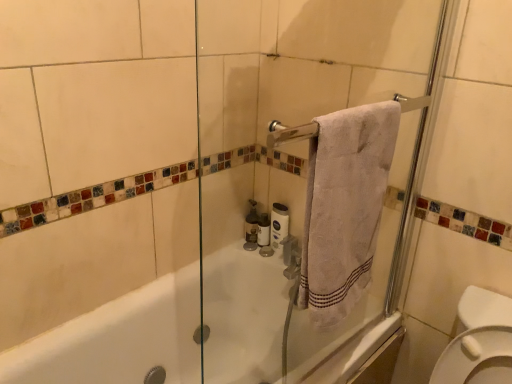
This screenshot has width=512, height=384. Describe the element at coordinates (251, 227) in the screenshot. I see `matte glass soap dispenser at center` at that location.

The width and height of the screenshot is (512, 384). Identify the location of white cotton towel at upper right. (345, 206).

What is the approximate height of white matte toilet paper at center, which is the first toilet paper in right-to-left order?

white matte toilet paper at center, which is the first toilet paper in right-to-left order, is 8.09 inches in height.

Locate an element on the screen. The width and height of the screenshot is (512, 384). transparent glass screen door at center is located at coordinates (303, 180).

Looking at the image, does white matte toilet paper at center, the 2th toilet paper positioned from the left, seem bigger or smaller compared to white matte toilet paper at center, which ranks as the first toilet paper in left-to-right order?

In the image, white matte toilet paper at center, the 2th toilet paper positioned from the left, appears to be larger than white matte toilet paper at center, which ranks as the first toilet paper in left-to-right order.

Is white matte toilet paper at center, which ranks as the first toilet paper in left-to-right order, surrounded by white matte toilet paper at center, the 2th toilet paper positioned from the left?

No.

From their relative heights in the image, would you say white matte toilet paper at center, the 2th toilet paper positioned from the left, is taller or shorter than white matte toilet paper at center, marked as the second toilet paper in a right-to-left arrangement?

white matte toilet paper at center, the 2th toilet paper positioned from the left, is taller than white matte toilet paper at center, marked as the second toilet paper in a right-to-left arrangement.

Looking at this image, is white matte toilet paper at center, the 2th toilet paper positioned from the left, oriented towards white matte toilet paper at center, which ranks as the first toilet paper in left-to-right order?

No, white matte toilet paper at center, the 2th toilet paper positioned from the left, does not turn towards white matte toilet paper at center, which ranks as the first toilet paper in left-to-right order.

Can you confirm if white matte toilet paper at center, marked as the second toilet paper in a right-to-left arrangement, is smaller than white cotton towel at upper right?

Correct, white matte toilet paper at center, marked as the second toilet paper in a right-to-left arrangement, occupies less space than white cotton towel at upper right.

Is white matte toilet paper at center, marked as the second toilet paper in a right-to-left arrangement, far from white cotton towel at upper right?

No, white matte toilet paper at center, marked as the second toilet paper in a right-to-left arrangement, is not far from white cotton towel at upper right.

Is white matte toilet paper at center, marked as the second toilet paper in a right-to-left arrangement, spatially inside white cotton towel at upper right, or outside of it?

white matte toilet paper at center, marked as the second toilet paper in a right-to-left arrangement, is not enclosed by white cotton towel at upper right.

From the image's perspective, which toilet paper is the 2nd one below the white cotton towel at upper right? Please provide its 2D coordinates.

[(263, 230)]

Can you tell me how much transparent glass screen door at center and white matte toilet paper at center, which is the first toilet paper in right-to-left order, differ in facing direction?

The angle between the facing direction of transparent glass screen door at center and the facing direction of white matte toilet paper at center, which is the first toilet paper in right-to-left order, is 89.5 degrees.

Is transparent glass screen door at center positioned with its back to white matte toilet paper at center, which is the first toilet paper in right-to-left order?

Yes.

Between transparent glass screen door at center and white matte toilet paper at center, which is the first toilet paper in right-to-left order, which one appears on the left side from the viewer's perspective?

From the viewer's perspective, white matte toilet paper at center, which is the first toilet paper in right-to-left order, appears more on the left side.

Considering the relative positions of transparent glass screen door at center and white matte toilet paper at center, the 2th toilet paper positioned from the left, in the image provided, is transparent glass screen door at center behind white matte toilet paper at center, the 2th toilet paper positioned from the left,?

That is False.

Is white matte toilet paper at center, which is the first toilet paper in right-to-left order, surrounding matte glass soap dispenser at center?

No, matte glass soap dispenser at center is located outside of white matte toilet paper at center, which is the first toilet paper in right-to-left order.

Who is more distant, white matte toilet paper at center, the 2th toilet paper positioned from the left, or matte glass soap dispenser at center?

matte glass soap dispenser at center is further from the camera.

Does white matte toilet paper at center, which is the first toilet paper in right-to-left order, appear on the right side of matte glass soap dispenser at center?

Yes.

Considering the sizes of white matte toilet paper at center, the 2th toilet paper positioned from the left, and matte glass soap dispenser at center in the image, is white matte toilet paper at center, the 2th toilet paper positioned from the left, taller or shorter than matte glass soap dispenser at center?

white matte toilet paper at center, the 2th toilet paper positioned from the left, is taller than matte glass soap dispenser at center.

Looking at their sizes, would you say white matte toilet paper at center, the 2th toilet paper positioned from the left, is wider or thinner than transparent glass screen door at center?

Clearly, white matte toilet paper at center, the 2th toilet paper positioned from the left, has less width compared to transparent glass screen door at center.

How different are the orientations of white matte toilet paper at center, the 2th toilet paper positioned from the left, and transparent glass screen door at center in degrees?

89.5 degrees separate the facing orientations of white matte toilet paper at center, the 2th toilet paper positioned from the left, and transparent glass screen door at center.

Considering the positions of objects white matte toilet paper at center, the 2th toilet paper positioned from the left, and transparent glass screen door at center in the image provided, who is behind, white matte toilet paper at center, the 2th toilet paper positioned from the left, or transparent glass screen door at center?

white matte toilet paper at center, the 2th toilet paper positioned from the left, is more distant.

How different are the orientations of white cotton towel at upper right and matte glass soap dispenser at center in degrees?

The facing directions of white cotton towel at upper right and matte glass soap dispenser at center are 86.9 degrees apart.

Is point (330, 217) closer or farther from the camera than point (249, 225)?

Clearly, point (330, 217) is closer to the camera than point (249, 225).

This screenshot has width=512, height=384. Find the location of `toiletry that is below the white cotton towel at upper right (from the image's perspective)`. toiletry that is below the white cotton towel at upper right (from the image's perspective) is located at coordinates (251, 227).

In the scene shown: From the image's perspective, is matte glass soap dispenser at center located beneath white matte toilet paper at center, which is the first toilet paper in right-to-left order?

No, from the image's perspective, matte glass soap dispenser at center is not beneath white matte toilet paper at center, which is the first toilet paper in right-to-left order.

Based on the photo, considering the relative positions of matte glass soap dispenser at center and white matte toilet paper at center, the 2th toilet paper positioned from the left, in the image provided, is matte glass soap dispenser at center to the right of white matte toilet paper at center, the 2th toilet paper positioned from the left, from the viewer's perspective?

Incorrect, matte glass soap dispenser at center is not on the right side of white matte toilet paper at center, the 2th toilet paper positioned from the left.

Is matte glass soap dispenser at center not close to white matte toilet paper at center, the 2th toilet paper positioned from the left?

No, matte glass soap dispenser at center is not far from white matte toilet paper at center, the 2th toilet paper positioned from the left.

Is matte glass soap dispenser at center positioned with its back to white matte toilet paper at center, which is the first toilet paper in right-to-left order?

That's not correct — matte glass soap dispenser at center is not looking away from white matte toilet paper at center, which is the first toilet paper in right-to-left order.

The width and height of the screenshot is (512, 384). What are the coordinates of `toilet paper on the right of white matte toilet paper at center, marked as the second toilet paper in a right-to-left arrangement` in the screenshot? It's located at (279, 224).

What are the coordinates of `the 2nd toilet paper below the white cotton towel at upper right (from the image's perspective)` in the screenshot? It's located at (263, 230).

From the image, which object appears to be nearer to white matte toilet paper at center, the 2th toilet paper positioned from the left, matte glass soap dispenser at center or white cotton towel at upper right?

Among the two, white cotton towel at upper right is located nearer to white matte toilet paper at center, the 2th toilet paper positioned from the left.

Which object lies nearer to the anchor point matte glass soap dispenser at center, white matte toilet paper at center, marked as the second toilet paper in a right-to-left arrangement, or white cotton towel at upper right?

white matte toilet paper at center, marked as the second toilet paper in a right-to-left arrangement, is closer to matte glass soap dispenser at center.

When comparing their distances from white cotton towel at upper right, does transparent glass screen door at center or white matte toilet paper at center, the 2th toilet paper positioned from the left, seem closer?

white matte toilet paper at center, the 2th toilet paper positioned from the left.

Considering their positions, is white cotton towel at upper right positioned closer to matte glass soap dispenser at center than transparent glass screen door at center?

Based on the image, transparent glass screen door at center appears to be nearer to matte glass soap dispenser at center.

Based on their spatial positions, is white cotton towel at upper right or transparent glass screen door at center closer to white matte toilet paper at center, which is the first toilet paper in right-to-left order?

Based on the image, white cotton towel at upper right appears to be nearer to white matte toilet paper at center, which is the first toilet paper in right-to-left order.

Based on their spatial positions, is matte glass soap dispenser at center or transparent glass screen door at center closer to white matte toilet paper at center, which is the first toilet paper in right-to-left order?

transparent glass screen door at center is positioned closer to the anchor white matte toilet paper at center, which is the first toilet paper in right-to-left order.

Looking at the image, which one is located closer to white cotton towel at upper right, white matte toilet paper at center, which ranks as the first toilet paper in left-to-right order, or transparent glass screen door at center?

white matte toilet paper at center, which ranks as the first toilet paper in left-to-right order, is closer to white cotton towel at upper right.

Estimate the real-world distances between objects in this image. Which object is closer to transparent glass screen door at center, matte glass soap dispenser at center or white cotton towel at upper right?

matte glass soap dispenser at center.

Find the location of a particular element. toilet paper between white cotton towel at upper right and white matte toilet paper at center, marked as the second toilet paper in a right-to-left arrangement, from front to back is located at coordinates (279, 224).

Locate an element on the screen. The height and width of the screenshot is (384, 512). toilet paper between matte glass soap dispenser at center and white matte toilet paper at center, which is the first toilet paper in right-to-left order is located at coordinates (263, 230).

Identify the location of bath towel located between transparent glass screen door at center and white matte toilet paper at center, which ranks as the first toilet paper in left-to-right order, in the depth direction. (345, 206).

Locate an element on the screen. The width and height of the screenshot is (512, 384). toilet paper located between transparent glass screen door at center and white matte toilet paper at center, which ranks as the first toilet paper in left-to-right order, in the depth direction is located at coordinates (279, 224).